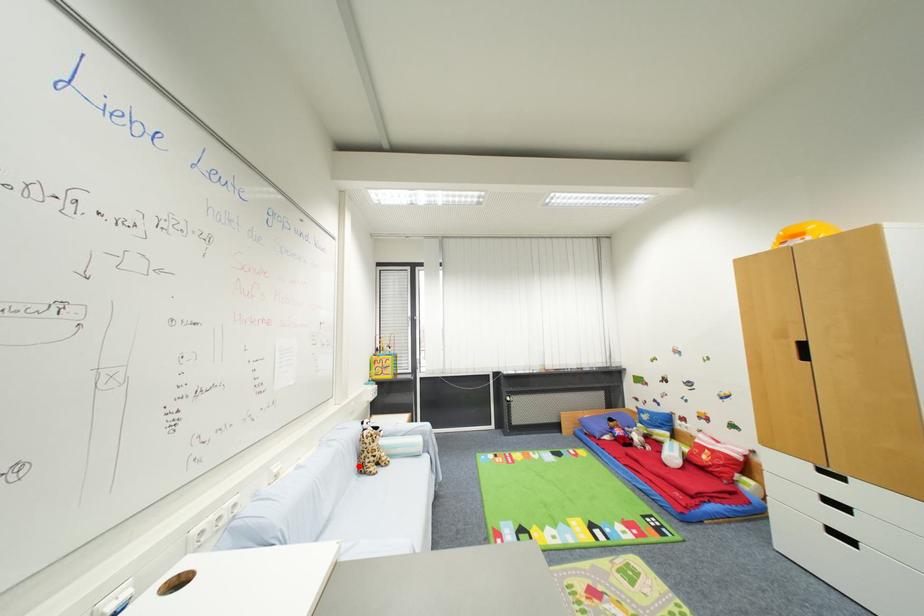
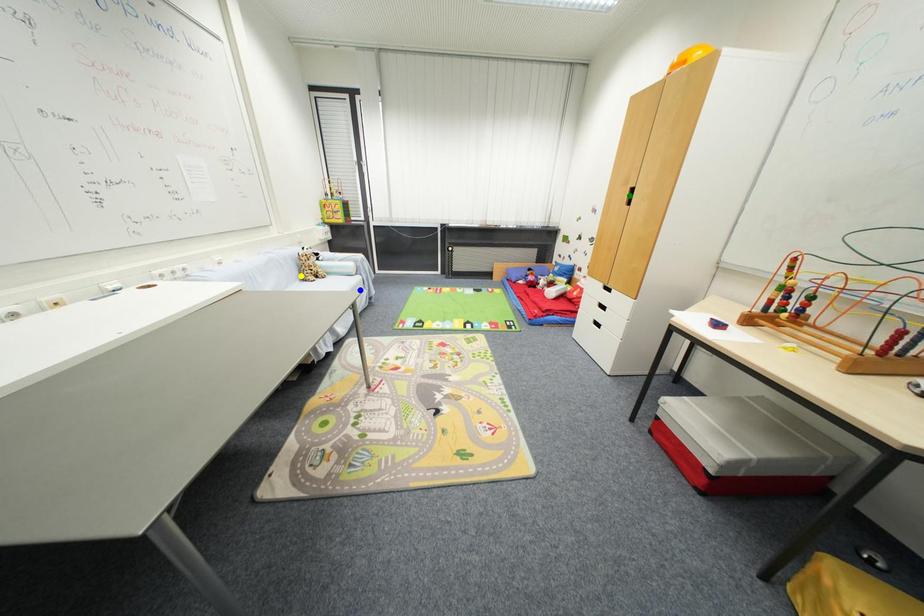
Question: I am providing you with two images of the same scene from different viewpoints. A red point is marked on the first image. You are given multiple points on the second image. Can you choose the point in image 2 that corresponds to the point in image 1?

Choices:
 (A) yellow point
 (B) blue point
 (C) green point

Answer: (A)